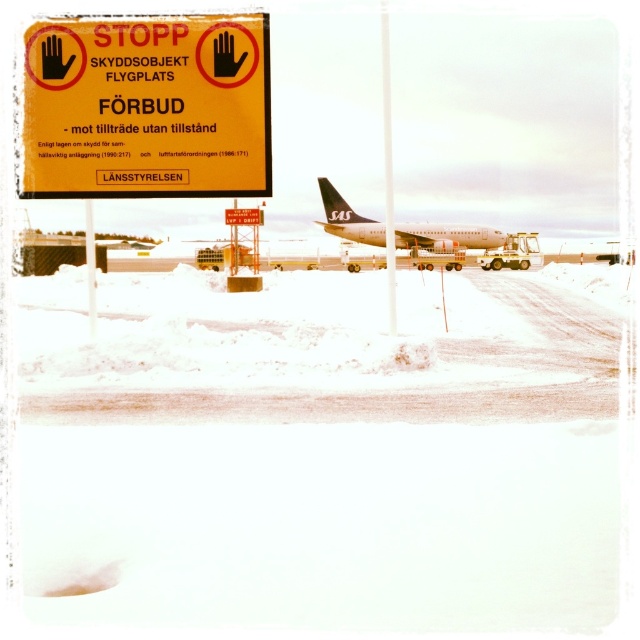
Can you confirm if yellow plastic sign at upper left is positioned to the right of metallic pole at center?

No, yellow plastic sign at upper left is not to the right of metallic pole at center.

Between yellow plastic sign at upper left and metallic pole at center, which one has less height?

Standing shorter between the two is yellow plastic sign at upper left.

Measure the distance between yellow plastic sign at upper left and camera.

They are 16.58 meters apart.

This screenshot has width=640, height=640. What are the coordinates of `yellow plastic sign at upper left` in the screenshot? It's located at (147, 108).

Where is `white asphalt tarmac at center`? The image size is (640, 640). white asphalt tarmac at center is located at coordinates pyautogui.click(x=320, y=452).

Does white asphalt tarmac at center appear under yellow plastic sign at upper left?

Correct, white asphalt tarmac at center is located below yellow plastic sign at upper left.

Which is behind, point (106, 604) or point (106, 49)?

The point (106, 49) is behind.

The width and height of the screenshot is (640, 640). I want to click on white asphalt tarmac at center, so click(320, 452).

Can you confirm if yellow plastic sign at upper left is positioned to the left of white matte airplane at center?

Correct, you'll find yellow plastic sign at upper left to the left of white matte airplane at center.

Which is in front, point (260, 93) or point (496, 234)?

Point (260, 93) is more forward.

Locate an element on the screen. The image size is (640, 640). yellow plastic sign at upper left is located at coordinates (147, 108).